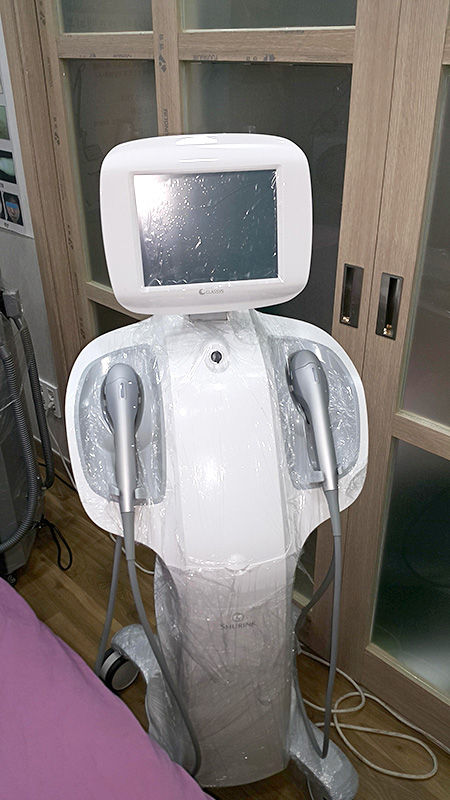
What are the coordinates of `gray cords` in the screenshot? It's located at (112, 593), (132, 581), (323, 588), (338, 590).